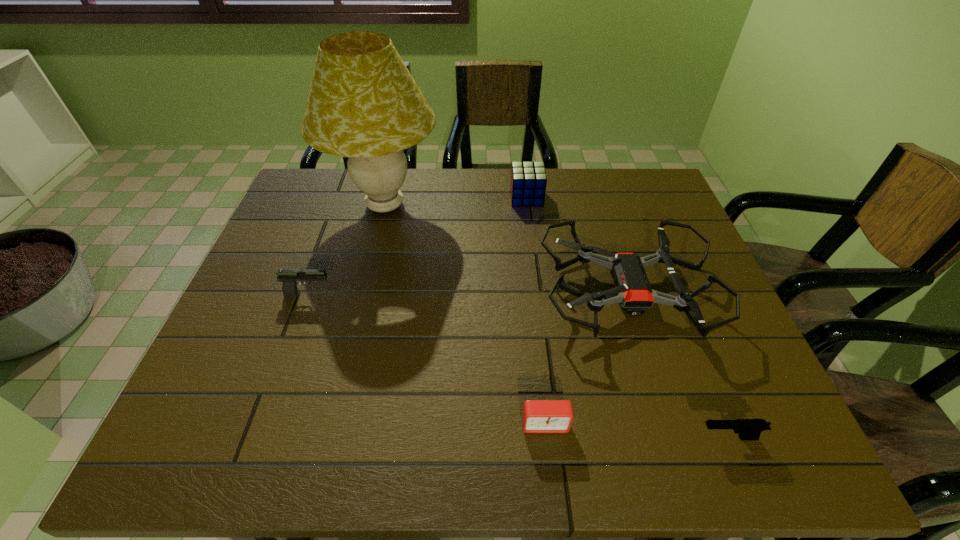
I want to click on the tallest object, so click(x=363, y=103).

Locate an element on the screen. The image size is (960, 540). cube is located at coordinates (528, 182).

The width and height of the screenshot is (960, 540). I want to click on drone, so click(632, 290).

Identify the location of the taller pistol. (289, 278).

This screenshot has width=960, height=540. In order to click on the left pistol in this screenshot , I will do `click(289, 278)`.

I want to click on alarm clock, so tap(539, 416).

At what (x,y) coordinates should I click in order to perform the action: click on the nearer pistol. Please return your answer as a coordinate pair (x, y). Looking at the image, I should click on (747, 429).

You are a GUI agent. You are given a task and a screenshot of the screen. Output one action in this format:
    pyautogui.click(x=<x>, y=<y>)
    Task: Click on the right pistol
    
    Given the screenshot: What is the action you would take?
    click(x=747, y=429)

You are a GUI agent. You are given a task and a screenshot of the screen. Output one action in this format:
    pyautogui.click(x=<x>, y=<y>)
    Task: Click on the free region located on the right of the tallest object
    
    Given the screenshot: What is the action you would take?
    pyautogui.click(x=519, y=205)

I want to click on vacant space situated on the right of the cube, so 558,198.